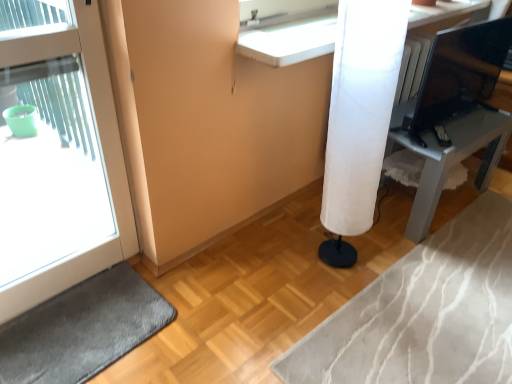
Identify the location of free area below white glossy door at left (from a real-world perspective). Image resolution: width=512 pixels, height=384 pixels. (63, 295).